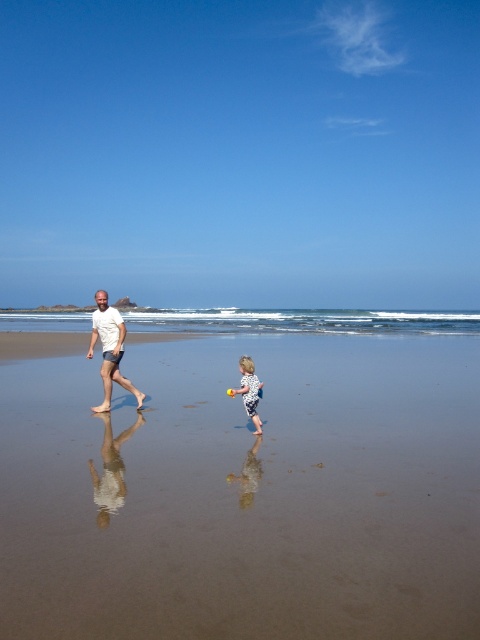
Between white cotton t-shirt at center and white dotted swimsuit at lower center, which one is positioned lower?

white dotted swimsuit at lower center

Which is in front, point (115, 358) or point (251, 387)?

Point (251, 387) is in front.

This screenshot has height=640, width=480. Describe the element at coordinates (109, 349) in the screenshot. I see `white cotton t-shirt at center` at that location.

I want to click on white cotton t-shirt at center, so click(x=109, y=349).

I want to click on smooth sand at center, so click(x=244, y=492).

Does smooth sand at center appear on the left side of white dotted swimsuit at lower center?

Yes, smooth sand at center is to the left of white dotted swimsuit at lower center.

Between point (78, 397) and point (250, 369), which one is positioned behind?

The point (78, 397) is more distant.

Where is `smooth sand at center`? smooth sand at center is located at coordinates 244,492.

Which is more to the left, clear blue water at center or white dotted swimsuit at lower center?

clear blue water at center is more to the left.

In the scene shown: Does clear blue water at center have a lesser height compared to white dotted swimsuit at lower center?

No, clear blue water at center is not shorter than white dotted swimsuit at lower center.

Locate an element on the screen. This screenshot has width=480, height=640. clear blue water at center is located at coordinates (303, 321).

Find the location of a particular element. clear blue water at center is located at coordinates (303, 321).